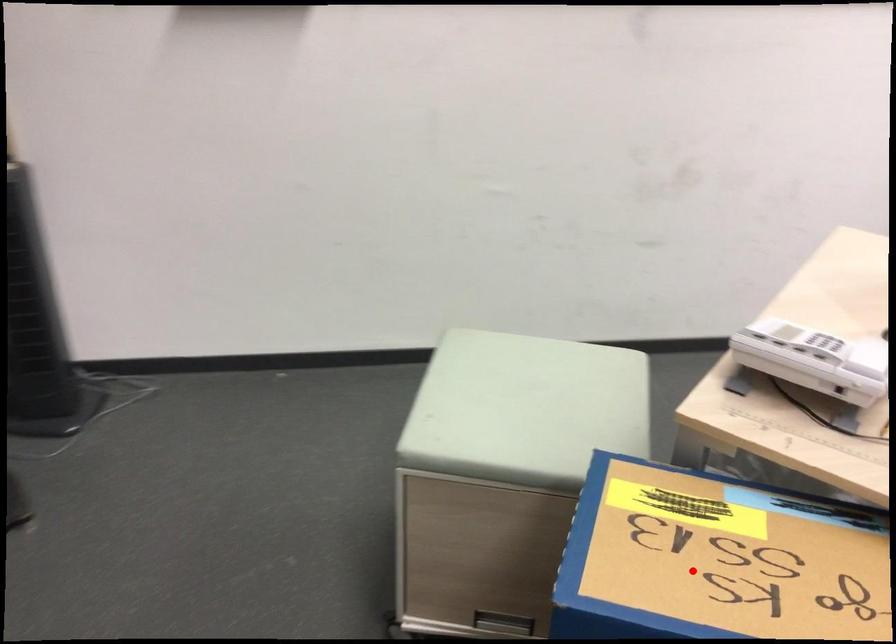
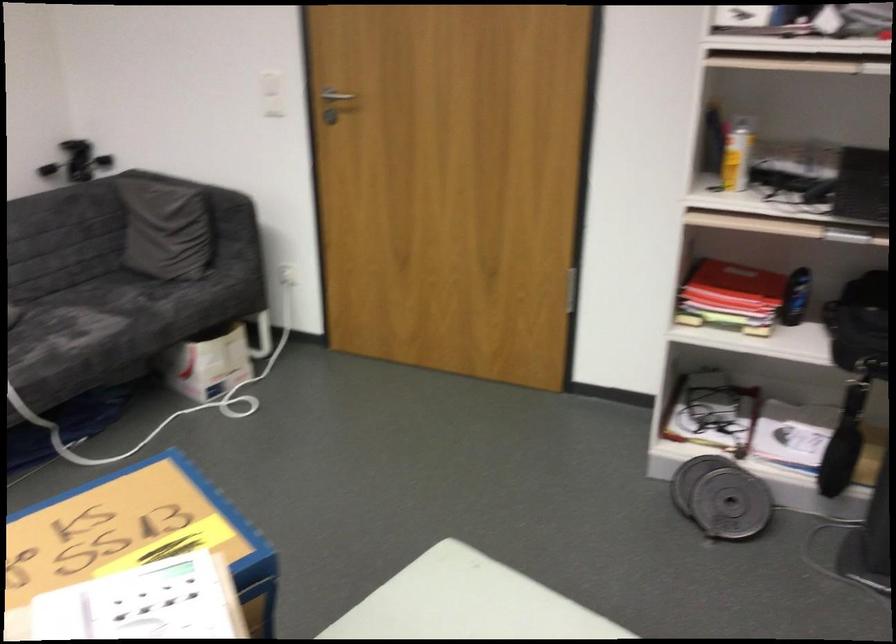
In the second image, find the point that corresponds to the highlighted location in the first image.

(139, 535)